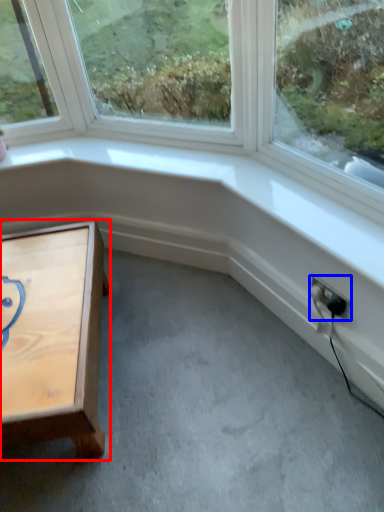
Question: Which of the following is the farthest to the observer, table (highlighted by a red box) or electric outlet (highlighted by a blue box)?

Choices:
 (A) table
 (B) electric outlet

Answer: (B)